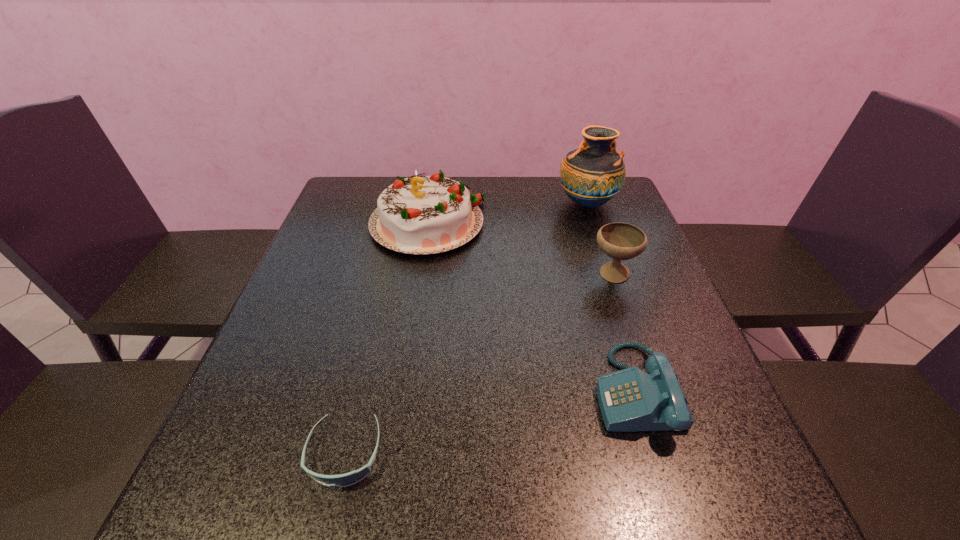
Identify the location of free space between the cake and the third tallest object. The width and height of the screenshot is (960, 540). (520, 249).

Where is `vacant space that is in between the telephone and the goggles`? vacant space that is in between the telephone and the goggles is located at coordinates (490, 421).

Identify the location of free spot between the cake and the telephone. The height and width of the screenshot is (540, 960). (531, 307).

Image resolution: width=960 pixels, height=540 pixels. In order to click on vacant space that's between the third nearest object and the shortest object in this screenshot , I will do `click(479, 364)`.

I want to click on vacant region between the pottery and the goggles, so click(466, 328).

You are a GUI agent. You are given a task and a screenshot of the screen. Output one action in this format:
    pyautogui.click(x=<x>, y=<y>)
    Task: Click on the unoccupied position between the cake and the shortest object
    The image size is (960, 540).
    Given the screenshot: What is the action you would take?
    pyautogui.click(x=386, y=339)

I want to click on vacant point located between the pottery and the goggles, so click(x=466, y=328).

This screenshot has height=540, width=960. What are the coordinates of `the second closest object to the shortest object` in the screenshot? It's located at (420, 215).

Choose which object is the fourth nearest neighbor to the goggles. Please provide its 2D coordinates. Your answer should be formatted as a tuple, i.e. [(x, y)], where the tuple contains the x and y coordinates of a point satisfying the conditions above.

[(593, 174)]